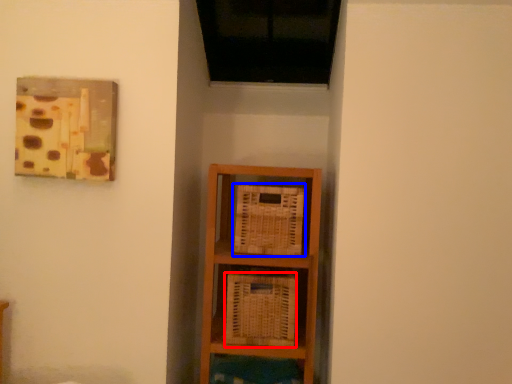
Question: Which object is further to the camera taking this photo, basket (highlighted by a red box) or basket (highlighted by a blue box)?

Choices:
 (A) basket
 (B) basket

Answer: (B)